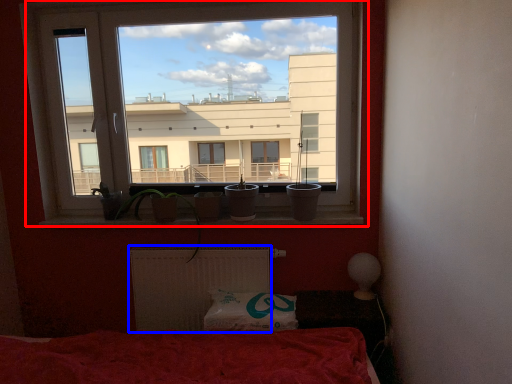
Question: Which object is further to the camera taking this photo, window (highlighted by a red box) or radiator (highlighted by a blue box)?

Choices:
 (A) window
 (B) radiator

Answer: (B)